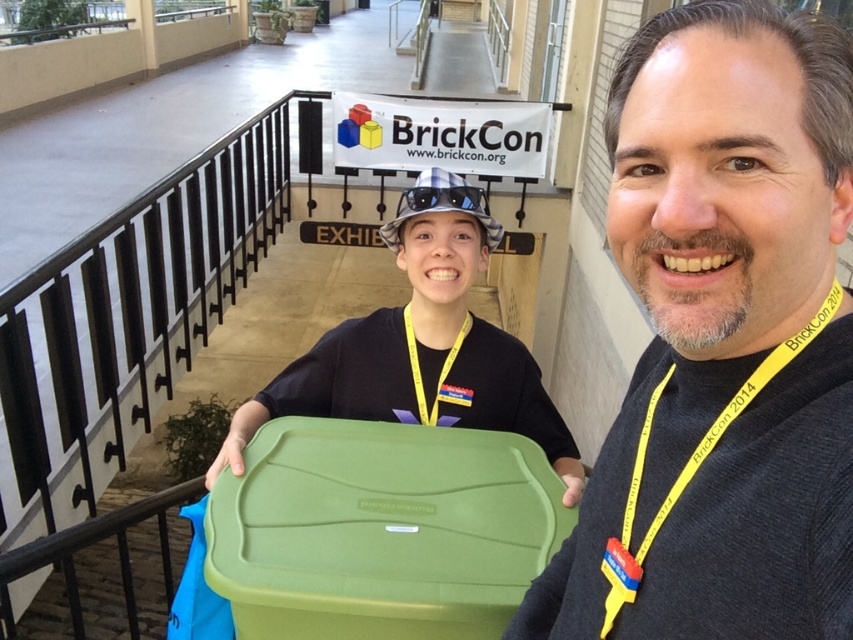
Question: Which point is farther to the camera?

Choices:
 (A) (440, 289)
 (B) (697, 465)

Answer: (A)

Question: Is matte black shirt at center to the right of green plastic bin at center from the viewer's perspective?

Choices:
 (A) yes
 (B) no

Answer: (A)

Question: From the image, what is the correct spatial relationship of matte black shirt at center in relation to green plastic bin at center?

Choices:
 (A) above
 (B) below

Answer: (B)

Question: Does matte black shirt at center have a smaller size compared to green plastic bin at center?

Choices:
 (A) no
 (B) yes

Answer: (B)

Question: Among these points, which one is nearest to the camera?

Choices:
 (A) (616, 189)
 (B) (294, 400)

Answer: (A)